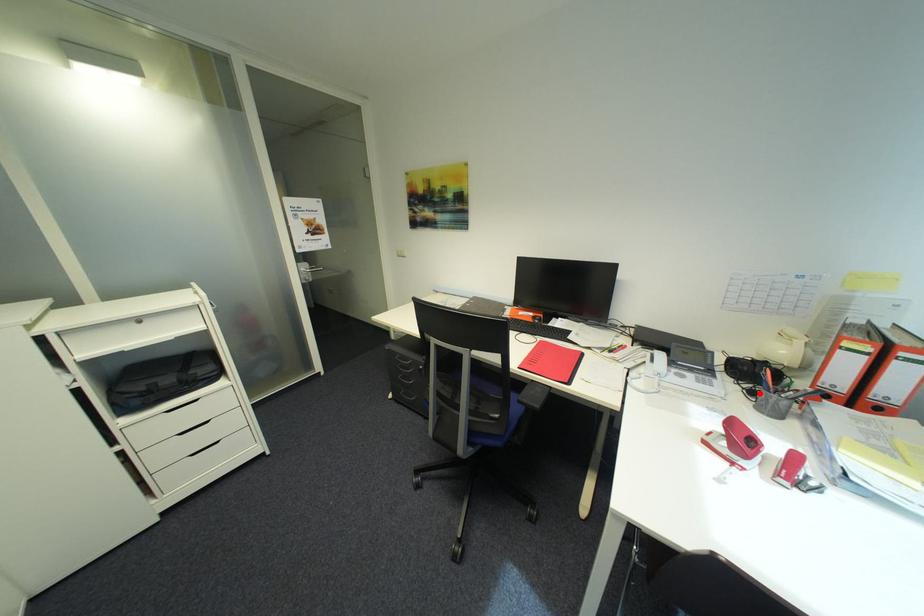
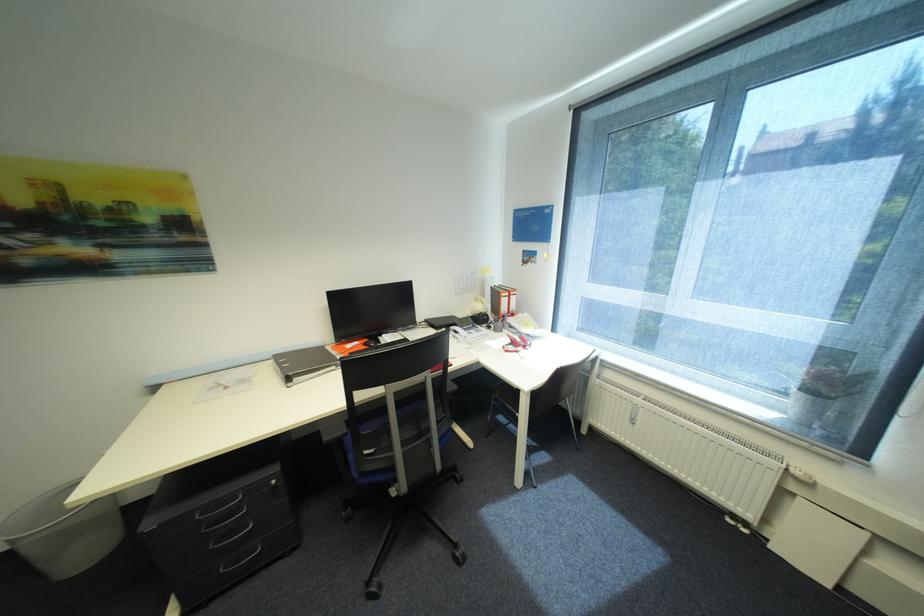
The point at the highlighted location is marked in the first image. Where is the corresponding point in the second image?

(496, 328)